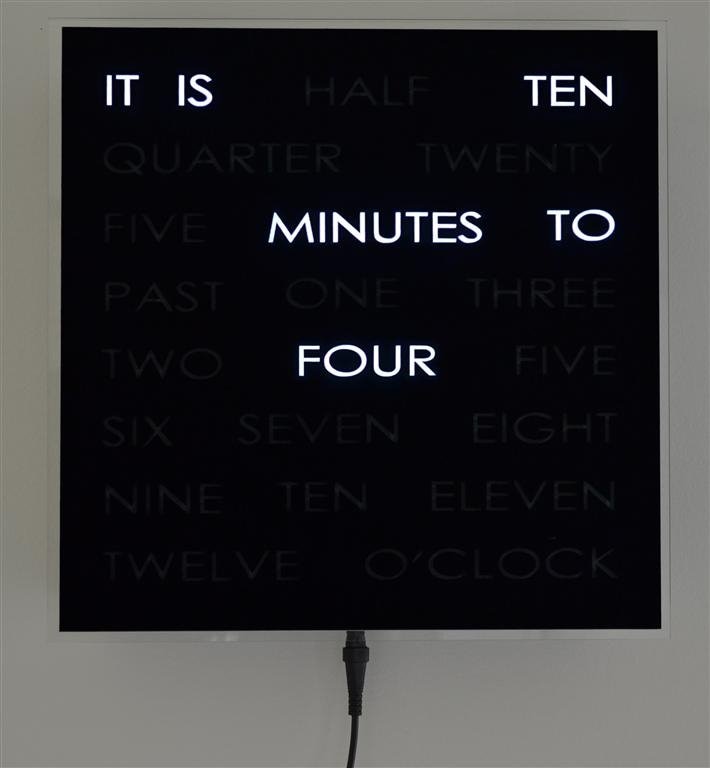
Locate an element on the screen. This screenshot has height=768, width=710. clock is located at coordinates (413, 538).